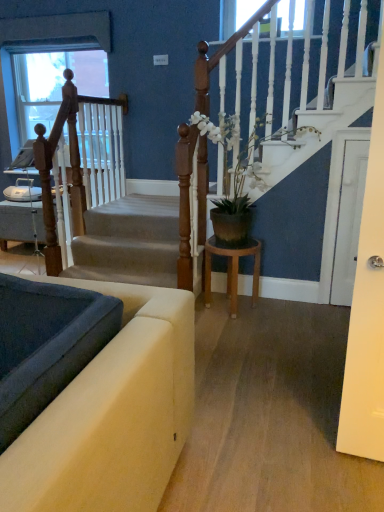
Question: From the image's perspective, is wooden at left positioned above or below wooden stool at center?

Choices:
 (A) above
 (B) below

Answer: (A)

Question: From a real-world perspective, relative to wooden stool at center, is wooden at left vertically above or below?

Choices:
 (A) above
 (B) below

Answer: (A)

Question: Estimate the real-world distances between objects in this image. Which object is closer to the wooden at left?

Choices:
 (A) white glossy door at right
 (B) white matte plant pot at center
 (C) wooden stool at center
 (D) velvet beige sofa at lower left
 (E) smooth gray carpet at lower left

Answer: (B)

Question: Which object is the closest to the white matte plant pot at center?

Choices:
 (A) wooden at left
 (B) smooth gray carpet at lower left
 (C) velvet beige sofa at lower left
 (D) white glossy door at right
 (E) wooden stool at center

Answer: (E)